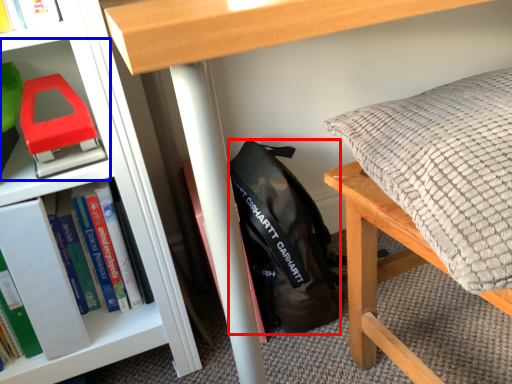
Question: Among these objects, which one is farthest to the camera, backpack (highlighted by a red box) or shelf (highlighted by a blue box)?

Choices:
 (A) backpack
 (B) shelf

Answer: (A)